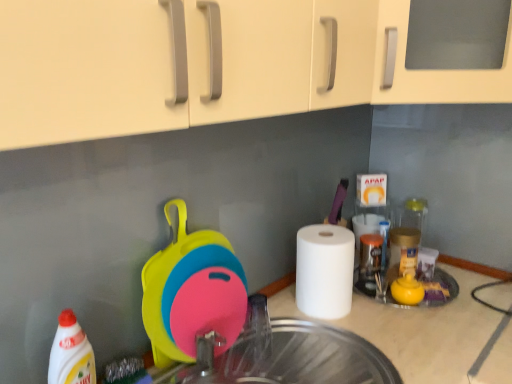
The height and width of the screenshot is (384, 512). Find the location of `free point above transparent glass sink at center (from a real-world perspective)`. free point above transparent glass sink at center (from a real-world perspective) is located at coordinates (305, 359).